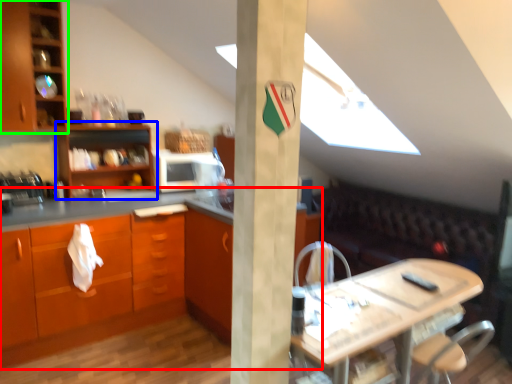
Question: Which object is the farthest from countertop (highlighted by a red box)? Choose among these: shelf (highlighted by a blue box) or cabinetry (highlighted by a green box).

Choices:
 (A) shelf
 (B) cabinetry

Answer: (B)